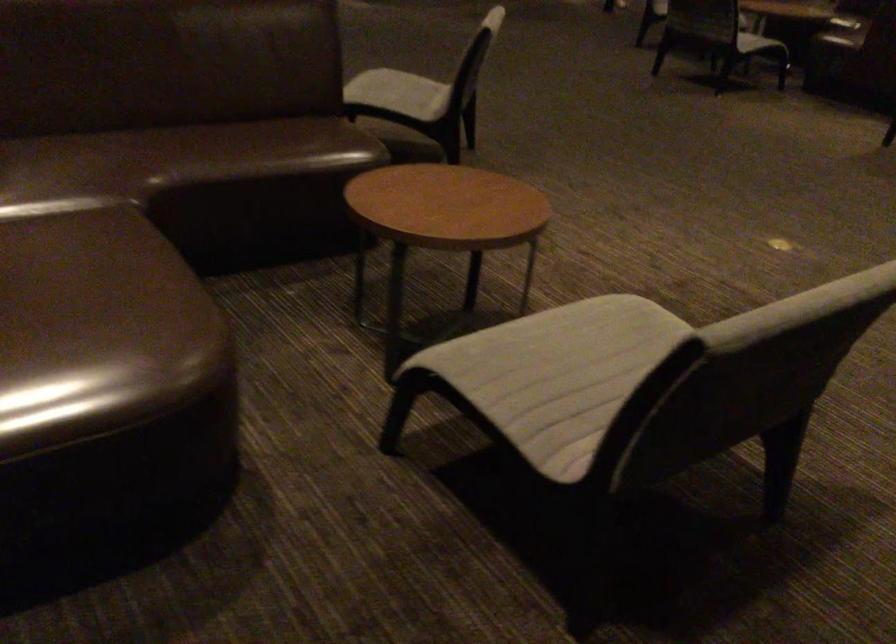
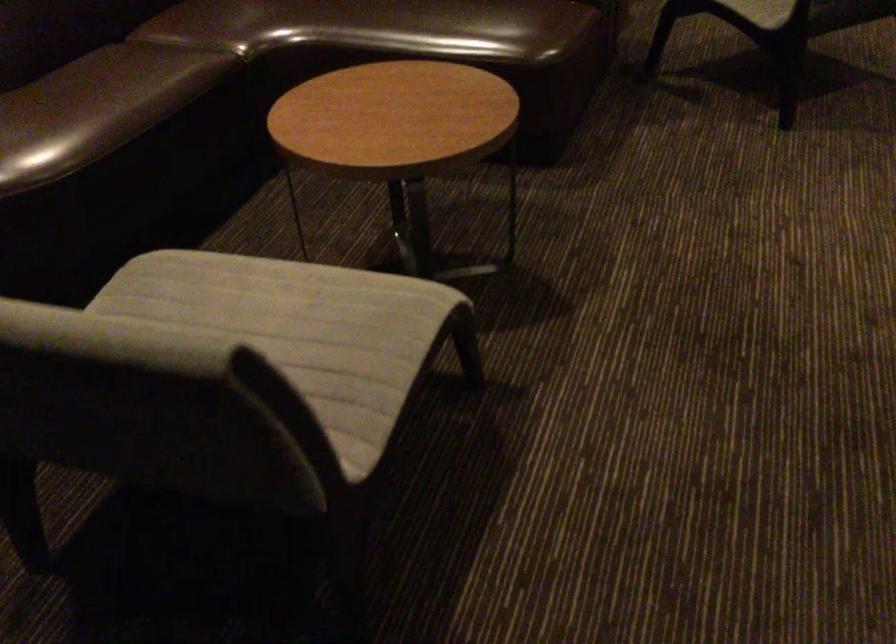
Find the pixel in the second image that matches point (176, 314) in the first image.

(42, 138)